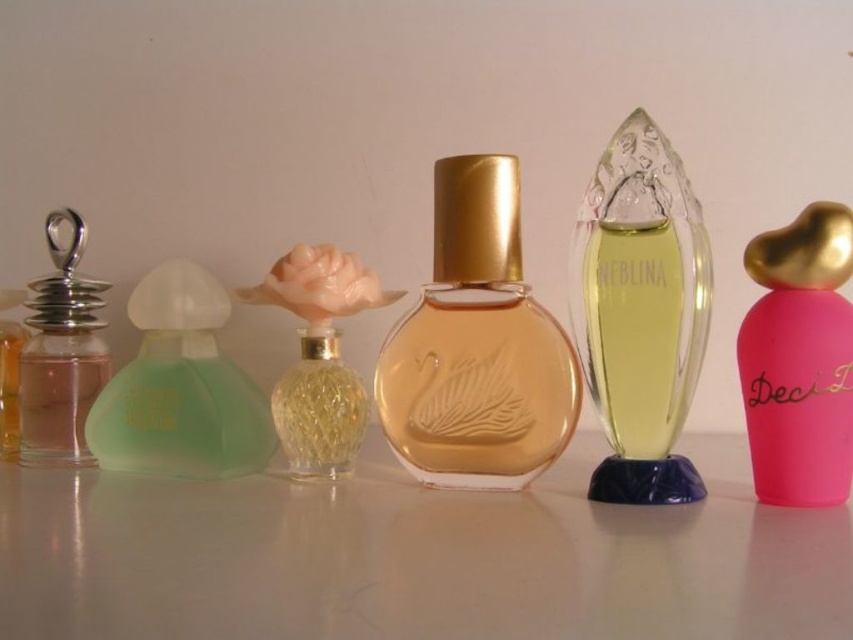
You are arranging perfume bottles on a shelf and need to ensure proper visibility. Which of the two bottles, the translucent glass bottle at center or the translucent yellow glass at center, is positioned closer to the viewer to allow better visibility?

The translucent glass bottle at center is positioned closer to the viewer than the translucent yellow glass at center, so it allows better visibility.